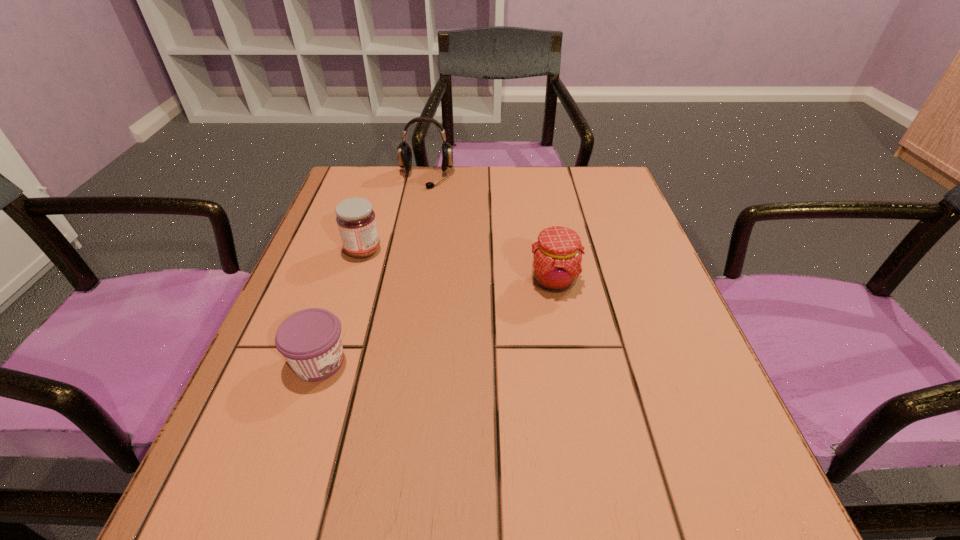
You are a GUI agent. You are given a task and a screenshot of the screen. Output one action in this format:
    pyautogui.click(x=<x>, y=<y>)
    Task: Click on the free space that satisfies the following two spatial constraints: 1. on the front side of the second farthest object; 2. on the front label of the nearest jam
    
    Given the screenshot: What is the action you would take?
    pyautogui.click(x=328, y=362)

The height and width of the screenshot is (540, 960). Identify the location of free space that satisfies the following two spatial constraints: 1. with the microphone on the side of the headset; 2. on the front label of the shortest object. (394, 362).

Identify the location of blank area in the image that satisfies the following two spatial constraints: 1. with the microphone on the side of the tallest object; 2. on the front label of the nearest object. (394, 362).